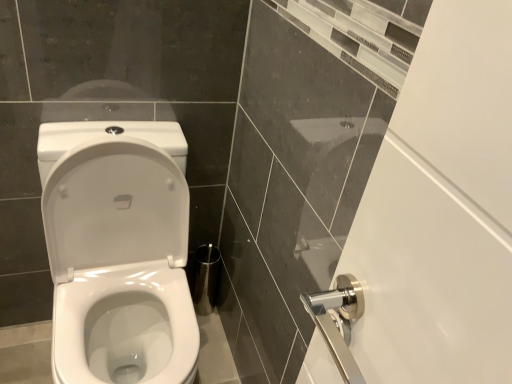
Question: Should I look upward or downward to see white glossy toilet at left?

Choices:
 (A) down
 (B) up

Answer: (A)